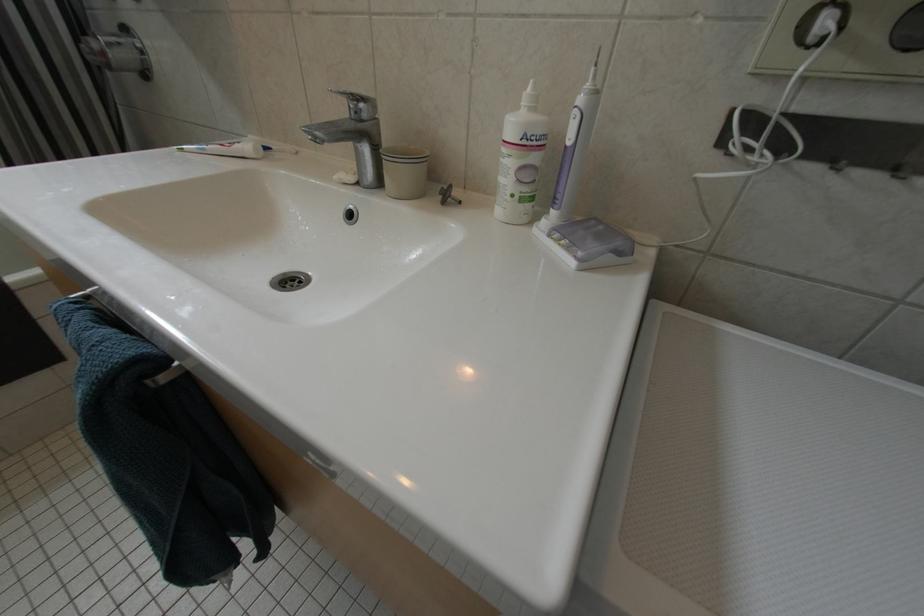
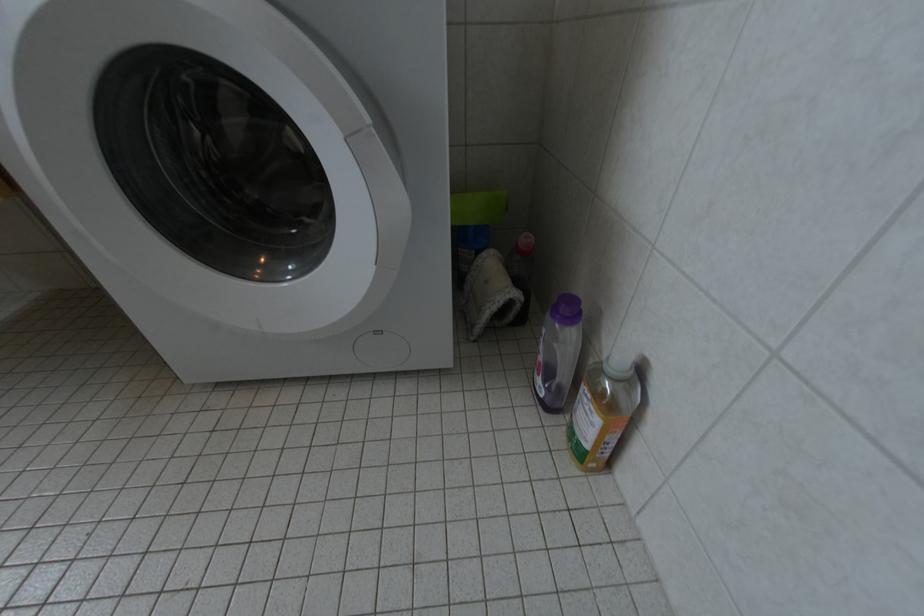
Question: The images are taken continuously from a first-person perspective. In which direction is your viewpoint rotating?

Choices:
 (A) Left
 (B) Right
 (C) Up
 (D) Down

Answer: (B)